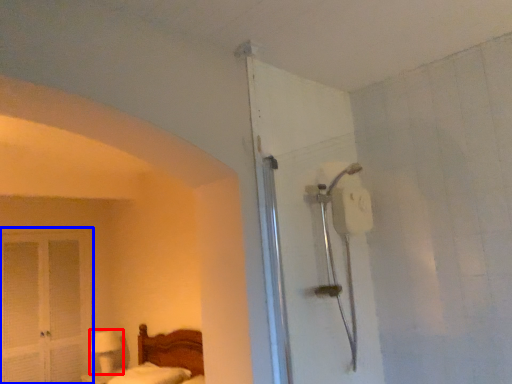
Question: Which point is further to the camera, table lamp (highlighted by a red box) or screen door (highlighted by a blue box)?

Choices:
 (A) table lamp
 (B) screen door

Answer: (A)